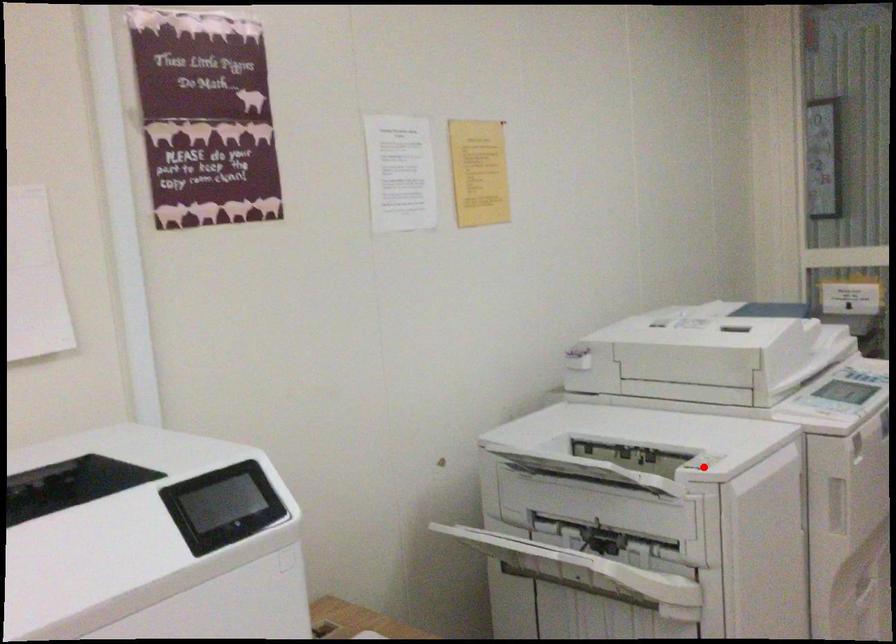
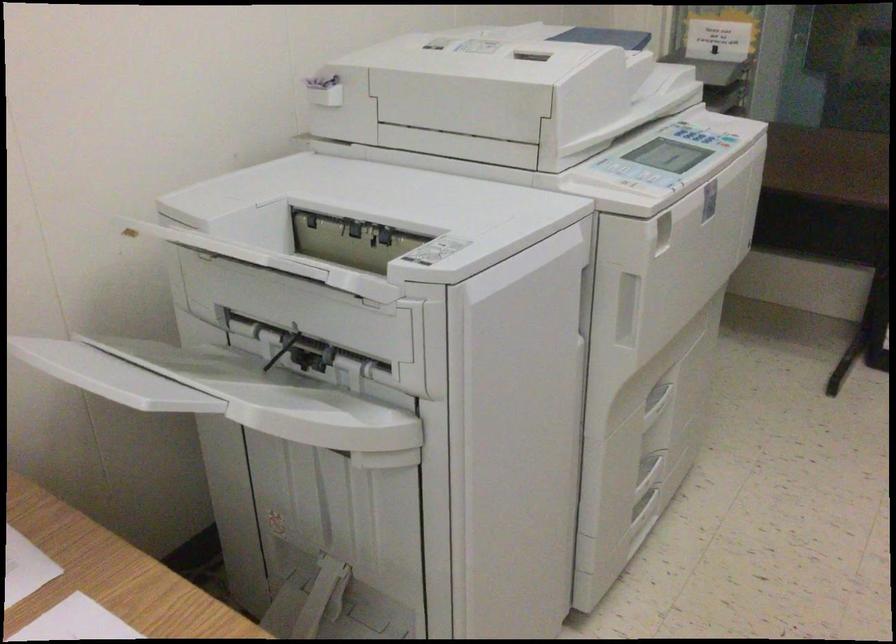
The point at the highlighted location is marked in the first image. Where is the corresponding point in the second image?

(435, 251)